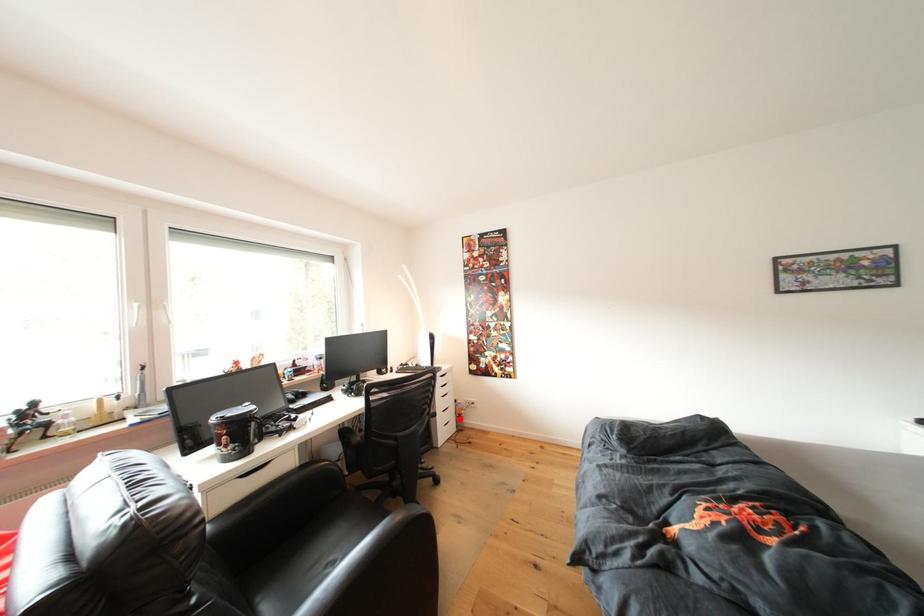
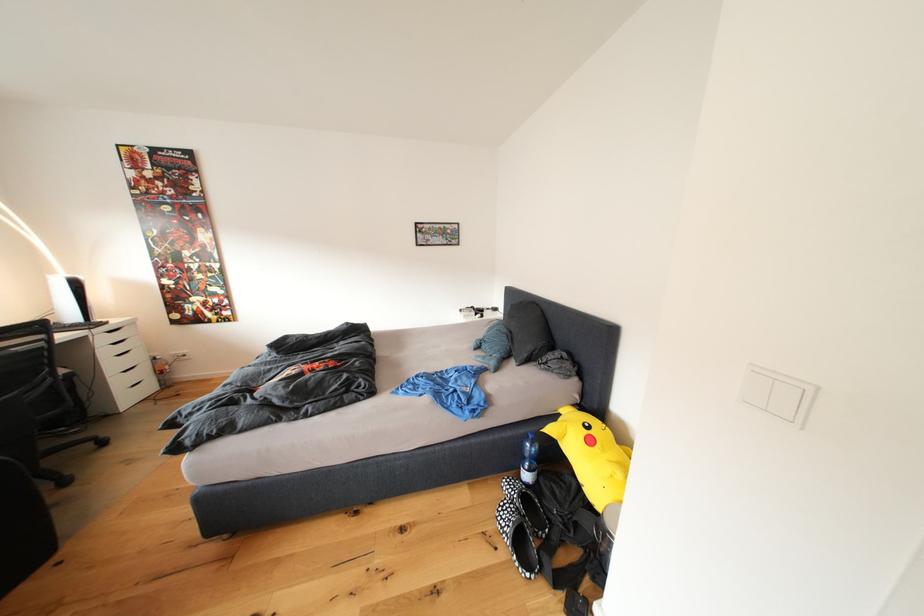
Question: A red point is marked in image1. In image2, is the corresponding 3D point closer to the camera or farther? Reply with the corresponding letter.

Choices:
 (A) The corresponding 3D point is closer.
 (B) The corresponding 3D point is farther.

Answer: (A)